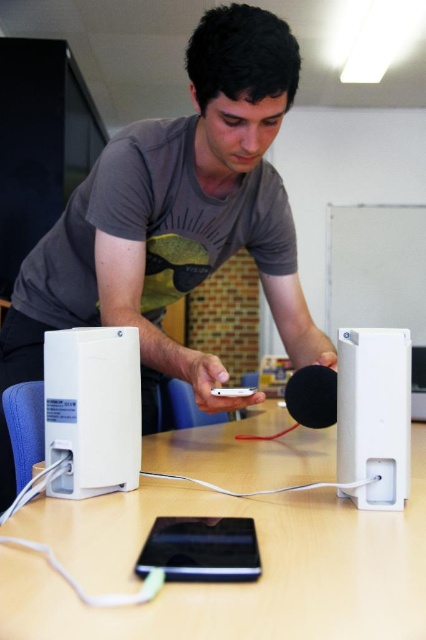
Question: Which point is farther to the camera?

Choices:
 (A) gray matte shirt at center
 (B) white plastic table at center
 (C) black matte/ipod at center

Answer: (A)

Question: Can you confirm if gray matte shirt at center is positioned below satin silver ipod at center?

Choices:
 (A) yes
 (B) no

Answer: (B)

Question: Can you confirm if white plastic speaker at left is wider than satin silver ipod at center?

Choices:
 (A) no
 (B) yes

Answer: (B)

Question: Which point is closer to the camera?

Choices:
 (A) (101, 492)
 (B) (340, 426)

Answer: (A)

Question: Can you confirm if gray matte shirt at center is positioned below white matte speaker at center?

Choices:
 (A) no
 (B) yes

Answer: (A)

Question: Based on their relative distances, which object is farther from the white plastic table at center?

Choices:
 (A) black matte/ipod at center
 (B) satin silver ipod at center
 (C) white plastic speaker at left

Answer: (B)